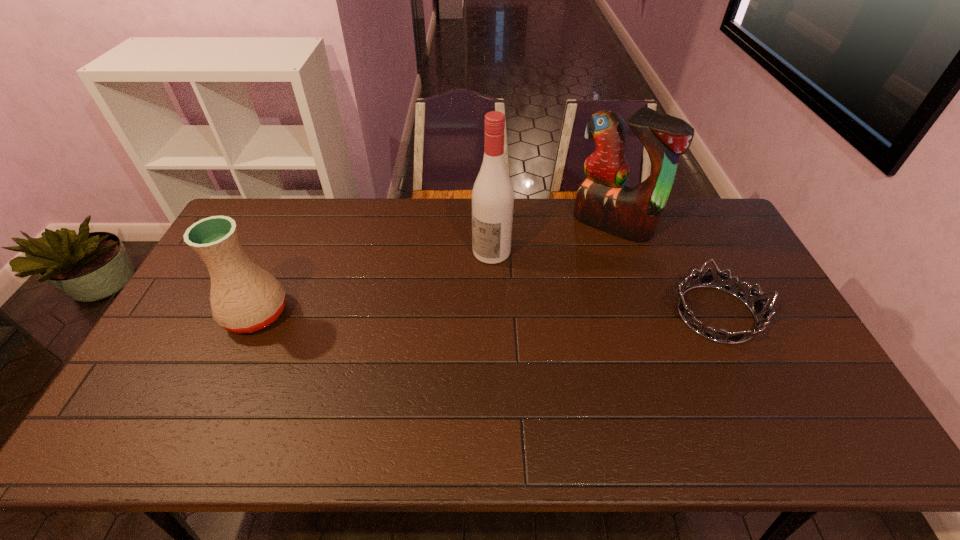
The height and width of the screenshot is (540, 960). In order to click on vacant point located between the parrot and the second object from left to right in this screenshot , I will do `click(552, 238)`.

I want to click on free space between the leftmost object and the second tallest object, so pyautogui.click(x=434, y=269).

Identify the location of vacant space that's between the third object from right to left and the parrot. click(552, 238).

I want to click on free space between the pottery and the third object from right to left, so click(373, 283).

The width and height of the screenshot is (960, 540). In order to click on object that is the third closest one to the tiara in this screenshot , I will do `click(244, 298)`.

Choose which object is the second nearest neighbor to the leftmost object. Please provide its 2D coordinates. Your answer should be formatted as a tuple, i.e. [(x, y)], where the tuple contains the x and y coordinates of a point satisfying the conditions above.

[(603, 200)]

This screenshot has width=960, height=540. I want to click on free space in the image that satisfies the following two spatial constraints: 1. on the back side of the alcohol; 2. on the left side of the parrot, so click(x=491, y=224).

The image size is (960, 540). Find the location of `vacant space that satisfies the following two spatial constraints: 1. on the back side of the shortest object; 2. on the front-facing side of the pottery`. vacant space that satisfies the following two spatial constraints: 1. on the back side of the shortest object; 2. on the front-facing side of the pottery is located at coordinates (256, 314).

This screenshot has height=540, width=960. I want to click on vacant position in the image that satisfies the following two spatial constraints: 1. on the back side of the second object from left to right; 2. on the left side of the parrot, so click(491, 224).

Find the location of a particular element. The image size is (960, 540). vacant space that satisfies the following two spatial constraints: 1. on the front side of the tiara; 2. on the front-facing side of the second object from left to right is located at coordinates (493, 314).